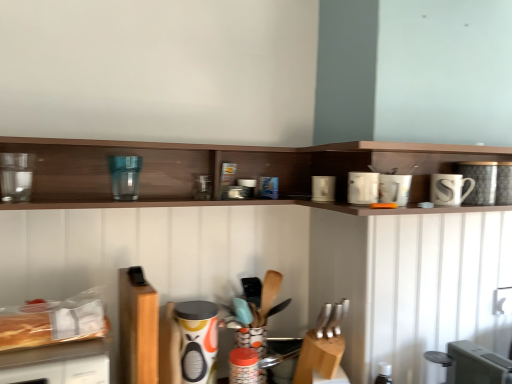
Question: Is point (375, 180) positioned closer to the camera than point (269, 306)?

Choices:
 (A) farther
 (B) closer

Answer: (B)

Question: From a real-world perspective, is white glossy coffee cup at upper right, the seventh appliance from the left, physically located above or below wooden spoon at center, the 2th silverware viewed from the front?

Choices:
 (A) above
 (B) below

Answer: (A)

Question: Which object is positioned farthest from the transparent glass water filter at upper left, which appears as the ninth appliance when viewed from the right?

Choices:
 (A) transparent glassware at upper center
 (B) silver metallic knives at center, which is the 2th silverware from back to front
 (C) white ceramic mug at upper right
 (D) translucent plastic bread at lower left
 (E) white glossy coffee cup at upper right, the seventh appliance from the left

Answer: (C)

Question: Which is nearer to the white ceramic mug at upper right?

Choices:
 (A) metallic silver toaster at lower right, the ninth appliance when ordered from left to right
 (B) translucent plastic bread at lower left
 (C) white glossy toaster at upper right, arranged as the sixth appliance when viewed from the left
 (D) white ceramic mug at upper right, the 8th appliance positioned from the left
 (E) white glossy coffee cup at upper right, the seventh appliance from the left

Answer: (D)